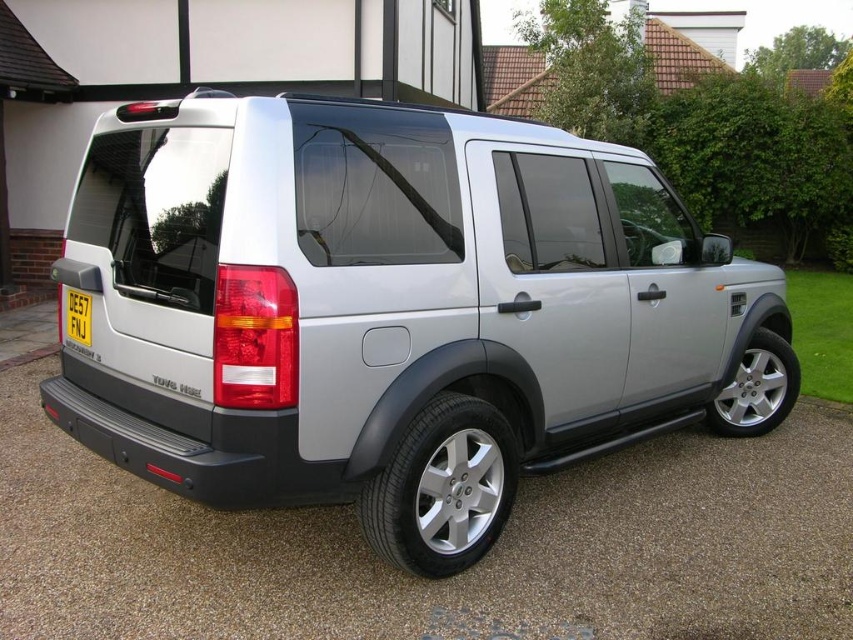
You are a mechanic inspecting the silver metallic tire at lower center and the silver metallic tire at lower right on a silver Land Rover Discovery parked on a gravel driveway. Which tire has a narrower width?

The silver metallic tire at lower center has a lesser width compared to the silver metallic tire at lower right, so the silver metallic tire at lower center is narrower.

You are a photographer standing in front of the silver Land Rover Discovery. You want to take a photo focusing on the silver metallic tire at lower right and the yellow plastic license plate at rear. Which object will appear larger in the photo?

The silver metallic tire at lower right will appear larger in the photo because it is closer to the viewer than the yellow plastic license plate at rear.

You are standing in front of the silver Land Rover Discovery parked on the gravel driveway. There are two points marked on the car, one at coordinate point (781,416) and the other at point (64,330). Which point is closer to you?

Point (64,330) is closer to you because it is less further to the camera than point (781,416).